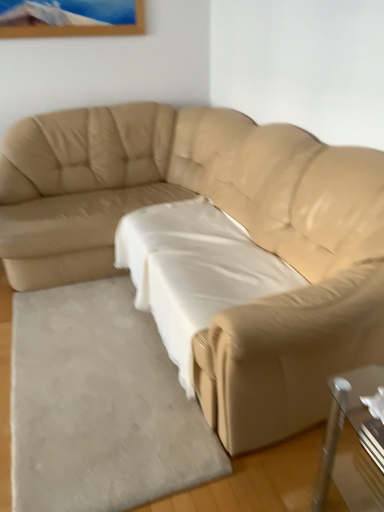
Measure the distance between point [229,188] and camera.

The depth of point [229,188] is 2.36 meters.

Identify the location of white fabric sheet at center. This screenshot has height=512, width=384. (x=194, y=270).

Does white fabric sheet at center appear on the left side of beige leather couch at center?

No, white fabric sheet at center is not to the left of beige leather couch at center.

Measure the distance from white fabric sheet at center to beige leather couch at center.

white fabric sheet at center and beige leather couch at center are 12.95 inches apart.

Is white fabric sheet at center inside the boundaries of beige leather couch at center, or outside?

white fabric sheet at center exists entirely within beige leather couch at center.

In the scene shown: Which is closer to the camera, [209,217] or [355,196]?

Positioned in front is point [355,196].

Is white fabric sheet at center oriented towards white soft rug at lower left?

No, white fabric sheet at center is not oriented towards white soft rug at lower left.

Is there a large distance between white fabric sheet at center and white soft rug at lower left?

No.

Which of these two, white fabric sheet at center or white soft rug at lower left, stands taller?

Standing taller between the two is white fabric sheet at center.

From a real-world perspective, is white fabric sheet at center positioned under white soft rug at lower left based on gravity?

Incorrect, from a real-world perspective, white fabric sheet at center is higher than white soft rug at lower left.

Is beige leather couch at center taller than white fabric sheet at center?

Yes.

Based on their positions, is beige leather couch at center located to the left or right of white fabric sheet at center?

From the image, it's evident that beige leather couch at center is to the left of white fabric sheet at center.

From the image's perspective, which is above, beige leather couch at center or white fabric sheet at center?

beige leather couch at center appears higher in the image.

Is white fabric sheet at center surrounded by beige leather couch at center?

Yes, white fabric sheet at center can be found within beige leather couch at center.

Are beige leather couch at center and white soft rug at lower left making contact?

No.

Can you confirm if beige leather couch at center is positioned to the left of white soft rug at lower left?

In fact, beige leather couch at center is to the right of white soft rug at lower left.

Image resolution: width=384 pixels, height=512 pixels. Identify the location of mat below the white fabric sheet at center (from a real-world perspective). (99, 405).

Considering the relative sizes of white soft rug at lower left and white fabric sheet at center in the image provided, is white soft rug at lower left thinner than white fabric sheet at center?

No.

In the image, is white soft rug at lower left on the left side or the right side of white fabric sheet at center?

From the image, it's evident that white soft rug at lower left is to the left of white fabric sheet at center.

From the image's perspective, is white soft rug at lower left located beneath white fabric sheet at center?

Correct, white soft rug at lower left appears lower than white fabric sheet at center in the image.

Is white soft rug at lower left thinner than beige leather couch at center?

Indeed, white soft rug at lower left has a lesser width compared to beige leather couch at center.

Between white soft rug at lower left and beige leather couch at center, which one has less height?

white soft rug at lower left.

From a real-world perspective, is white soft rug at lower left physically below beige leather couch at center?

Yes, from a real-world perspective, white soft rug at lower left is below beige leather couch at center.

You are a GUI agent. You are given a task and a screenshot of the screen. Output one action in this format:
    pyautogui.click(x=<x>, y=<y>)
    Task: Click on the sheet behind the beige leather couch at center
    
    Given the screenshot: What is the action you would take?
    (x=194, y=270)

In the image, there is a white fabric sheet at center. At what (x,y) coordinates should I click in order to perform the action: click on mat below it (from the image's perspective). Please return your answer as a coordinate pair (x, y). Looking at the image, I should click on (99, 405).

Based on their spatial positions, is white fabric sheet at center or beige leather couch at center closer to white soft rug at lower left?

Among the two, white fabric sheet at center is located nearer to white soft rug at lower left.

Looking at the image, which one is located closer to white fabric sheet at center, beige leather couch at center or white soft rug at lower left?

beige leather couch at center.

Estimate the real-world distances between objects in this image. Which object is closer to beige leather couch at center, white fabric sheet at center or white soft rug at lower left?

white fabric sheet at center is positioned closer to the anchor beige leather couch at center.

From the image, which object appears to be farther from beige leather couch at center, white soft rug at lower left or white fabric sheet at center?

Among the two, white soft rug at lower left is located further to beige leather couch at center.

Considering their positions, is beige leather couch at center positioned closer to white soft rug at lower left than white fabric sheet at center?

white fabric sheet at center is positioned closer to the anchor white soft rug at lower left.

In the scene shown: Based on their spatial positions, is white soft rug at lower left or beige leather couch at center further from white fabric sheet at center?

Based on the image, white soft rug at lower left appears to be further to white fabric sheet at center.

Identify the location of mat located between beige leather couch at center and white fabric sheet at center in the depth direction. The image size is (384, 512). (99, 405).